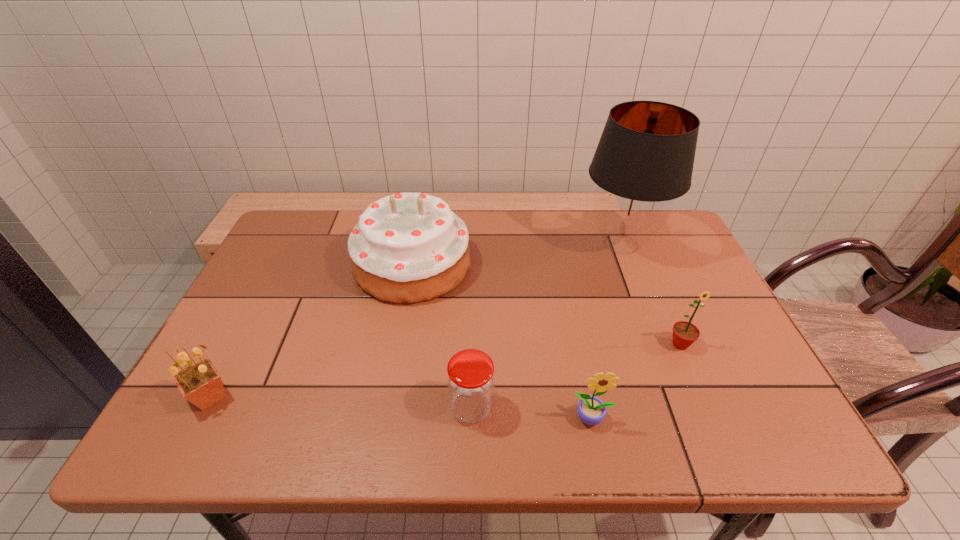
What are the coordinates of `vacant space that satisfies the following two spatial constraints: 1. on the front side of the cake; 2. at the front of the leftmost object with flowers visible` in the screenshot? It's located at (390, 396).